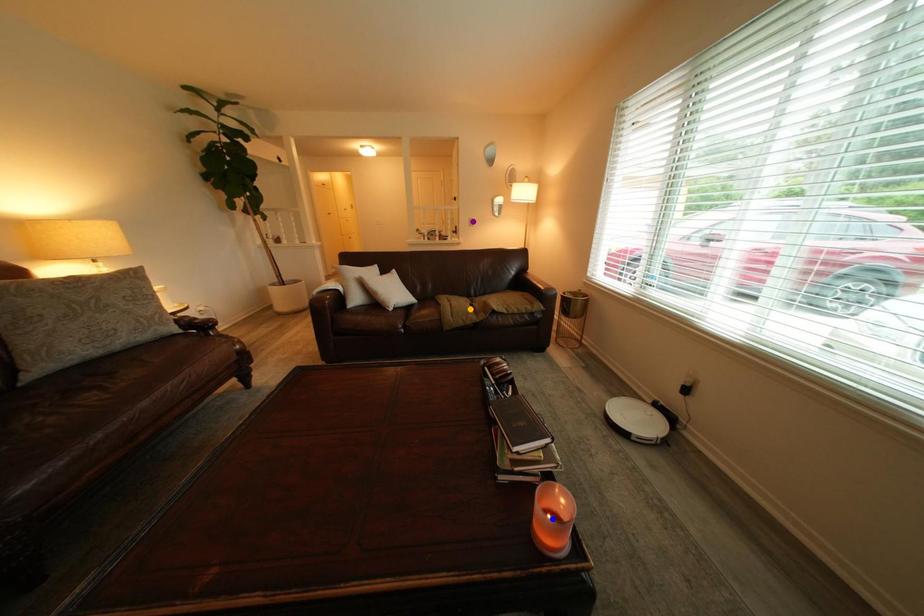
Order these from nearest to farthest:
blue point, orange point, purple point

1. blue point
2. orange point
3. purple point